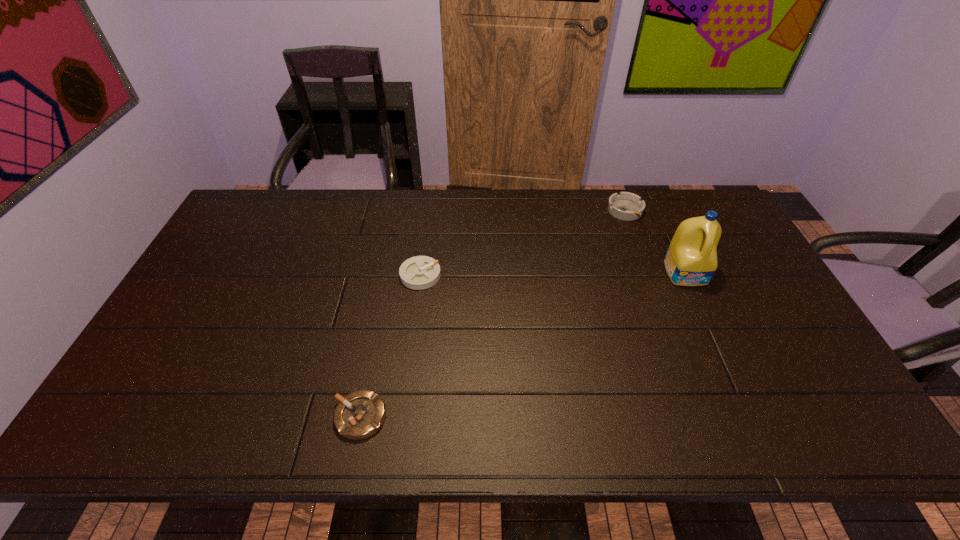
The image size is (960, 540). What are the coordinates of `free area in between the nearest ashtray and the detergent` in the screenshot? It's located at (523, 345).

At what (x,y) coordinates should I click in order to perform the action: click on free space between the second farthest ashtray and the farthest object. Please return your answer as a coordinate pair (x, y). Image resolution: width=960 pixels, height=540 pixels. Looking at the image, I should click on (523, 243).

In order to click on free space between the nearest object and the tallest ashtray in this screenshot , I will do `click(492, 314)`.

Locate an element on the screen. The height and width of the screenshot is (540, 960). vacant space that's between the rightmost ashtray and the second nearest ashtray is located at coordinates (523, 243).

The height and width of the screenshot is (540, 960). Identify the location of empty location between the second nearest ashtray and the nearest ashtray. (391, 346).

The height and width of the screenshot is (540, 960). Identify the location of vacant space that's between the second nearest ashtray and the second tallest object. (523, 243).

Where is `the third closest object to the second farthest ashtray`? This screenshot has width=960, height=540. the third closest object to the second farthest ashtray is located at coordinates (691, 260).

You are a GUI agent. You are given a task and a screenshot of the screen. Output one action in this format:
    pyautogui.click(x=<x>, y=<y>)
    Task: Click on the object that can be found as the third closest to the detergent
    The height and width of the screenshot is (540, 960).
    Given the screenshot: What is the action you would take?
    click(360, 414)

Locate which ashtray ranks in proximity to the second tallest object. Please provide its 2D coordinates. Your answer should be formatted as a tuple, i.e. [(x, y)], where the tuple contains the x and y coordinates of a point satisfying the conditions above.

[(420, 272)]

Identify the location of ashtray that stands as the closest to the nearest ashtray. This screenshot has height=540, width=960. (420, 272).